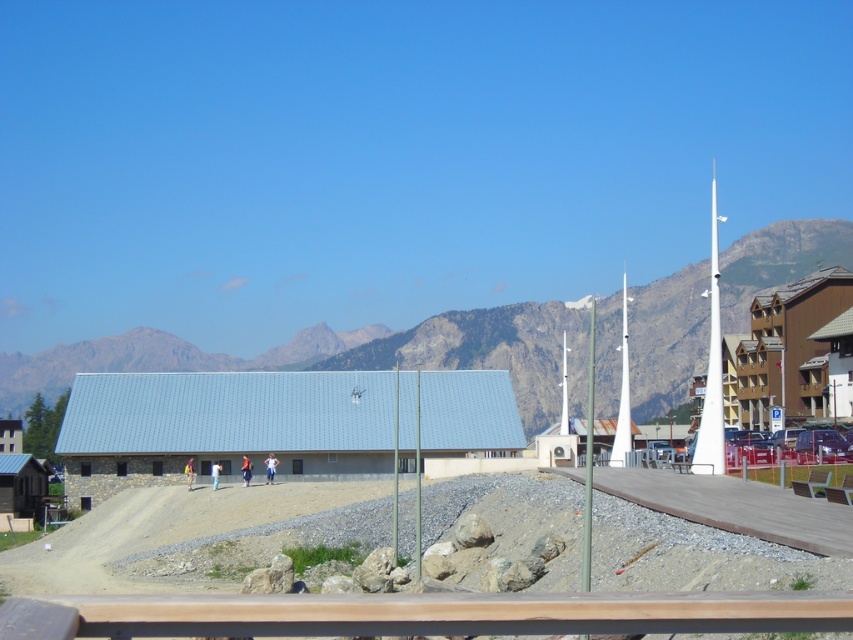
Question: Does gray metallic building at center have a smaller size compared to brown wooden rail at lower center?

Choices:
 (A) yes
 (B) no

Answer: (B)

Question: Among these objects, which one is farthest from the camera?

Choices:
 (A) white glossy flag pole at center right
 (B) white glossy flag pole at right
 (C) brown wooden rail at lower center

Answer: (A)

Question: Which object is closer to the camera taking this photo?

Choices:
 (A) white glossy flag pole at right
 (B) gray metallic building at center
 (C) brown wooden rail at lower center

Answer: (C)

Question: Which point is farther from the camera taking this photo?

Choices:
 (A) (624, 371)
 (B) (256, 604)
 (C) (567, 348)
 (D) (717, 244)

Answer: (D)

Question: From the image, what is the correct spatial relationship of gray metallic building at center in relation to white glossy flag pole at center right?

Choices:
 (A) below
 (B) above

Answer: (A)

Question: Can you confirm if white glossy flag pole at center right is smaller than white glossy flag pole at center?

Choices:
 (A) no
 (B) yes

Answer: (A)